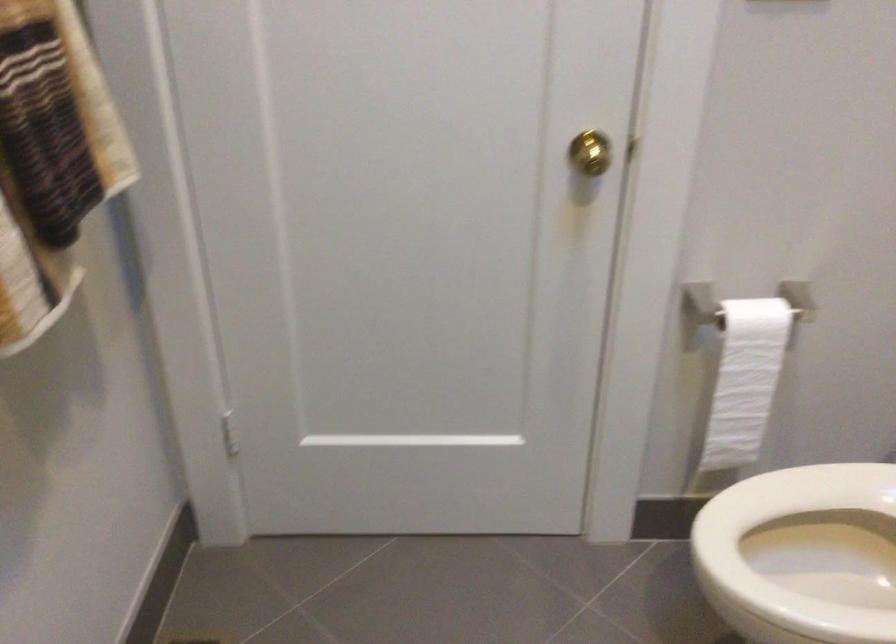
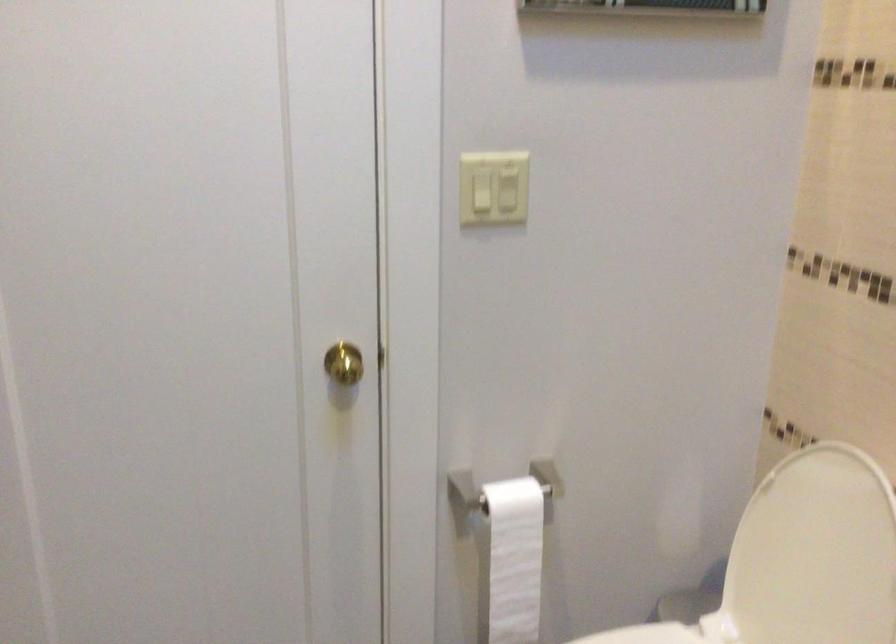
Question: How did the camera likely rotate?

Choices:
 (A) Left
 (B) Right
 (C) Up
 (D) Down

Answer: (B)